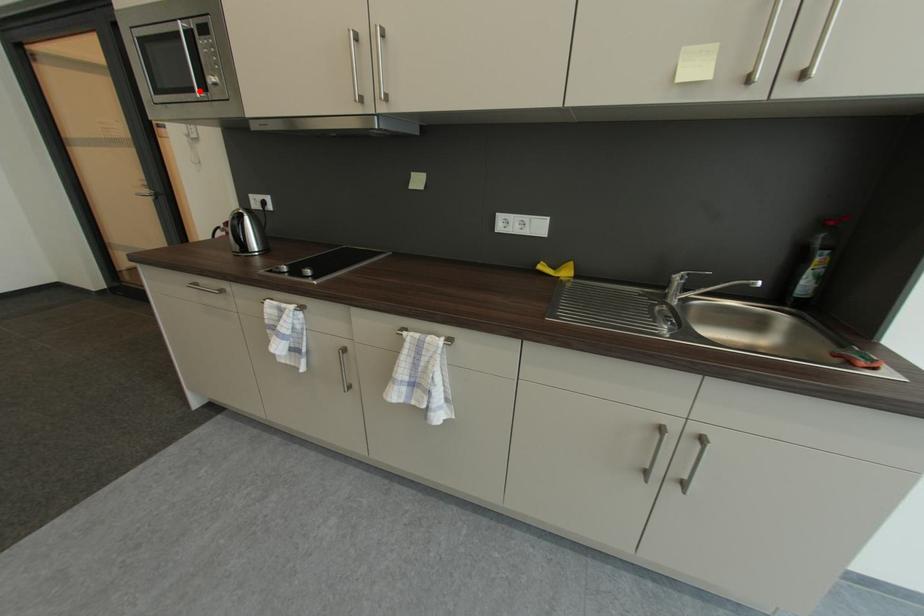
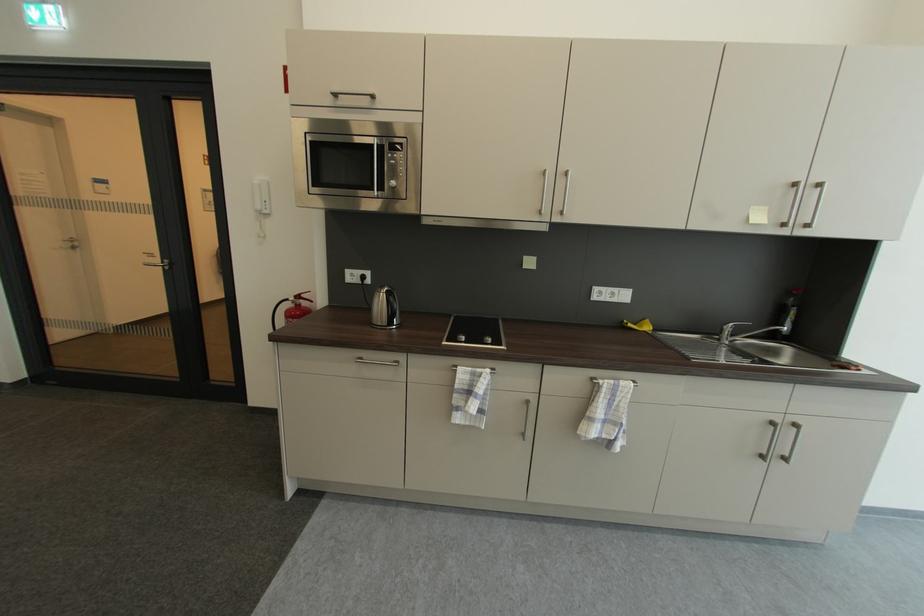
The point at the highlighted location is marked in the first image. Where is the corresponding point in the second image?

(380, 191)